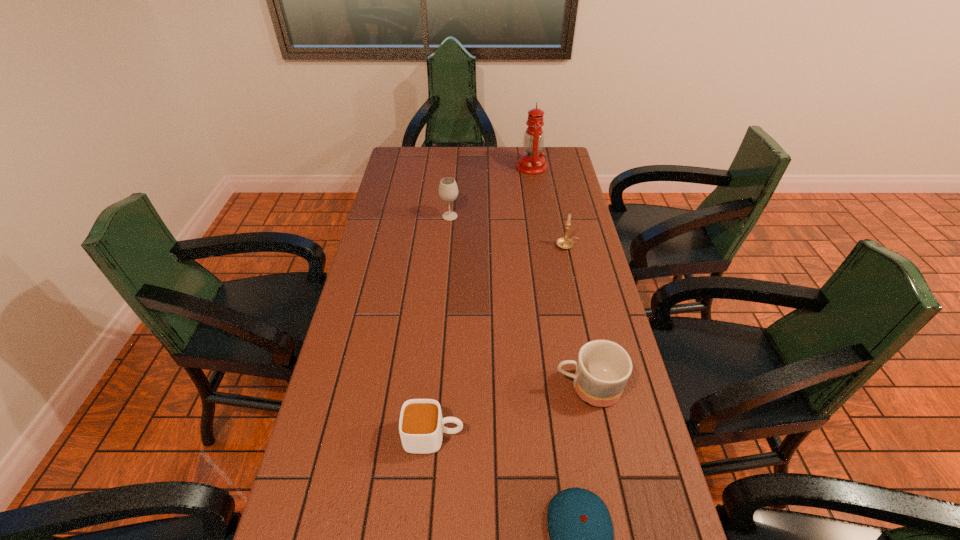
The height and width of the screenshot is (540, 960). Find the location of `vacant space at the left edge of the desktop`. vacant space at the left edge of the desktop is located at coordinates (417, 181).

Find the location of a particular element. free location at the right edge is located at coordinates (553, 212).

This screenshot has width=960, height=540. Find the location of `vacant space at the far left corner of the desktop`. vacant space at the far left corner of the desktop is located at coordinates pos(413,157).

Where is `vacant space that's between the third nearest object and the second nearest object`? The width and height of the screenshot is (960, 540). vacant space that's between the third nearest object and the second nearest object is located at coordinates (511, 412).

Where is `free spot between the second farthest object and the mug`? The image size is (960, 540). free spot between the second farthest object and the mug is located at coordinates (518, 302).

You are a GUI agent. You are given a task and a screenshot of the screen. Output one action in this format:
    pyautogui.click(x=<x>, y=<y>)
    Task: Click on the free spot between the mug and the oil lamp
    
    Given the screenshot: What is the action you would take?
    pyautogui.click(x=560, y=277)

This screenshot has height=540, width=960. I want to click on empty location between the candle holder and the fifth tallest object, so click(x=500, y=341).

Find the location of a particular element. The image size is (960, 540). empty space that is in between the wineglass and the candle holder is located at coordinates (509, 231).

In order to click on empty space that is in between the third farthest object and the fifth tallest object in this screenshot , I will do `click(500, 341)`.

You are a GUI agent. You are given a task and a screenshot of the screen. Output one action in this format:
    pyautogui.click(x=<x>, y=<y>)
    Task: Click on the vacant area that lies between the tallest object and the cup
    
    Given the screenshot: What is the action you would take?
    pyautogui.click(x=483, y=301)